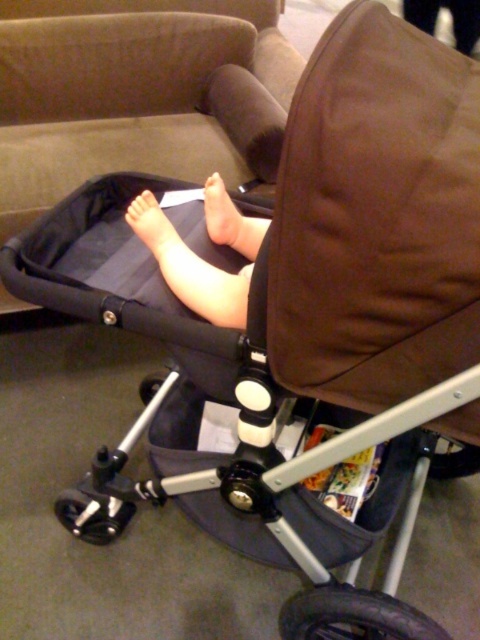
Does brown fabric couch at upper center have a greater width compared to matte black foot at center?

Indeed, brown fabric couch at upper center has a greater width compared to matte black foot at center.

This screenshot has height=640, width=480. What do you see at coordinates (135, 92) in the screenshot?
I see `brown fabric couch at upper center` at bounding box center [135, 92].

Is point (289, 51) farther from viewer compared to point (147, 198)?

Yes, it is behind point (147, 198).

You are a GUI agent. You are given a task and a screenshot of the screen. Output one action in this format:
    pyautogui.click(x=<x>, y=<y>)
    Task: Click on the brown fabric couch at upper center
    
    Given the screenshot: What is the action you would take?
    pyautogui.click(x=135, y=92)

Does brown fabric couch at upper center have a smaller size compared to smooth skin foot at center?

No.

Does point (202, 132) lie in front of point (126, 220)?

No, (202, 132) is further to viewer.

Measure the distance between brown fabric couch at upper center and camera.

brown fabric couch at upper center and camera are 5.12 feet apart from each other.

Find the location of a particular element. This screenshot has height=640, width=480. brown fabric couch at upper center is located at coordinates (135, 92).

Who is lower down, matte skin foot at center or matte black foot at center?

matte black foot at center is below.

Who is more distant from viewer, [236,246] or [166,237]?

Point [236,246]

The width and height of the screenshot is (480, 640). I want to click on matte skin foot at center, so click(223, 216).